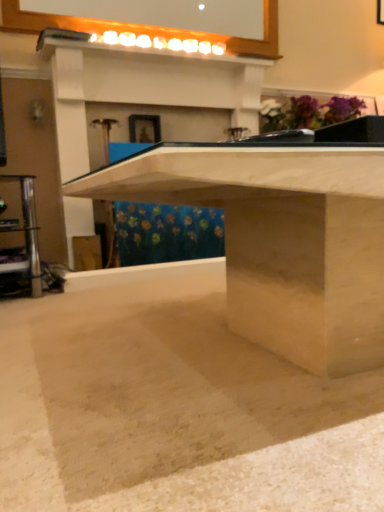
Question: Does matte gold picture frame at upper center appear on the right side of smooth concrete at center?

Choices:
 (A) yes
 (B) no

Answer: (B)

Question: Is smooth concrete at center a part of matte gold picture frame at upper center?

Choices:
 (A) no
 (B) yes

Answer: (A)

Question: From the image's perspective, is matte gold picture frame at upper center located above smooth concrete at center?

Choices:
 (A) no
 (B) yes

Answer: (B)

Question: Can you confirm if matte gold picture frame at upper center is wider than smooth concrete at center?

Choices:
 (A) no
 (B) yes

Answer: (A)

Question: Considering the relative positions of matte gold picture frame at upper center and smooth concrete at center in the image provided, is matte gold picture frame at upper center behind smooth concrete at center?

Choices:
 (A) yes
 (B) no

Answer: (A)

Question: From the image's perspective, is matte gold picture frame at upper center beneath smooth concrete at center?

Choices:
 (A) no
 (B) yes

Answer: (A)

Question: Is matte gold picture frame at upper center at the left side of sanded wood table at center?

Choices:
 (A) yes
 (B) no

Answer: (A)

Question: Considering the relative sizes of matte gold picture frame at upper center and sanded wood table at center in the image provided, is matte gold picture frame at upper center taller than sanded wood table at center?

Choices:
 (A) yes
 (B) no

Answer: (B)

Question: Is matte gold picture frame at upper center smaller than sanded wood table at center?

Choices:
 (A) no
 (B) yes

Answer: (B)

Question: From a real-world perspective, is matte gold picture frame at upper center located beneath sanded wood table at center?

Choices:
 (A) no
 (B) yes

Answer: (A)

Question: Considering the relative sizes of matte gold picture frame at upper center and sanded wood table at center in the image provided, is matte gold picture frame at upper center wider than sanded wood table at center?

Choices:
 (A) yes
 (B) no

Answer: (B)

Question: Would you consider matte gold picture frame at upper center to be distant from sanded wood table at center?

Choices:
 (A) yes
 (B) no

Answer: (A)

Question: From the image's perspective, is sanded wood table at center below smooth concrete at center?

Choices:
 (A) no
 (B) yes

Answer: (A)